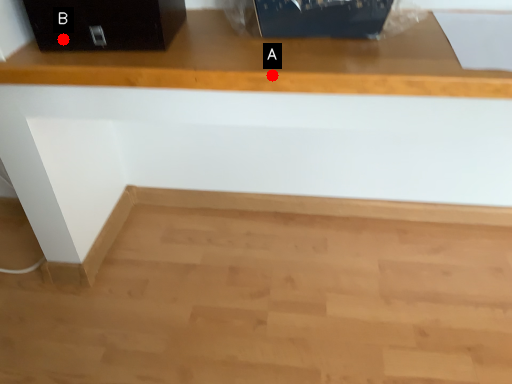
Question: Two points are circled on the image, labeled by A and B beside each circle. Which point appears farthest from the camera in this image?

Choices:
 (A) A is further
 (B) B is further

Answer: (B)